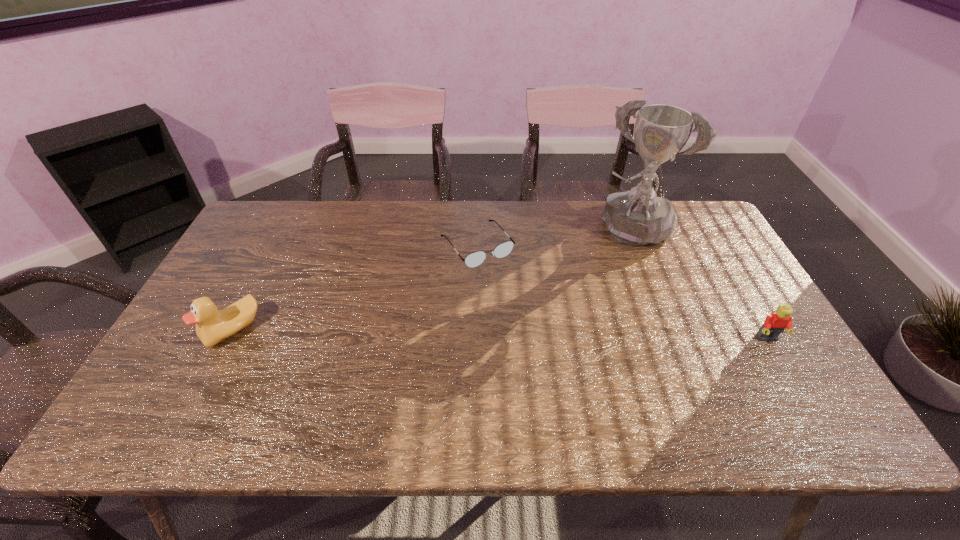
Image resolution: width=960 pixels, height=540 pixels. I want to click on vacant space at the near edge of the desktop, so click(238, 366).

Image resolution: width=960 pixels, height=540 pixels. In the image, there is a desktop. In order to click on vacant area at the right edge in this screenshot , I will do `click(692, 266)`.

This screenshot has width=960, height=540. What are the coordinates of `free region at the far left corner` in the screenshot? It's located at click(x=283, y=207).

You are a GUI agent. You are given a task and a screenshot of the screen. Output one action in this format:
    pyautogui.click(x=<x>, y=<y>)
    Task: Click on the vacant point located between the rightmost object and the leftmost object
    Image resolution: width=960 pixels, height=540 pixels.
    Given the screenshot: What is the action you would take?
    pyautogui.click(x=500, y=334)

Find the location of a particular element. The height and width of the screenshot is (540, 960). free space between the spectacles and the award is located at coordinates (553, 238).

Locate an element on the screen. The image size is (960, 540). blank region between the duck and the second object from right to left is located at coordinates (431, 279).

You are a GUI agent. You are given a task and a screenshot of the screen. Output one action in this format:
    pyautogui.click(x=<x>, y=<y>)
    Task: Click on the free space between the duck and the tallest object
    
    Given the screenshot: What is the action you would take?
    pyautogui.click(x=431, y=279)

Locate an element on the screen. The width and height of the screenshot is (960, 540). free space between the shortest object and the second object from right to left is located at coordinates (553, 238).

Locate an element on the screen. Image resolution: width=960 pixels, height=540 pixels. free space that is in between the spectacles and the Lego is located at coordinates (622, 292).

Where is `vacant region between the spectacles and the leftmost object`? vacant region between the spectacles and the leftmost object is located at coordinates (355, 288).